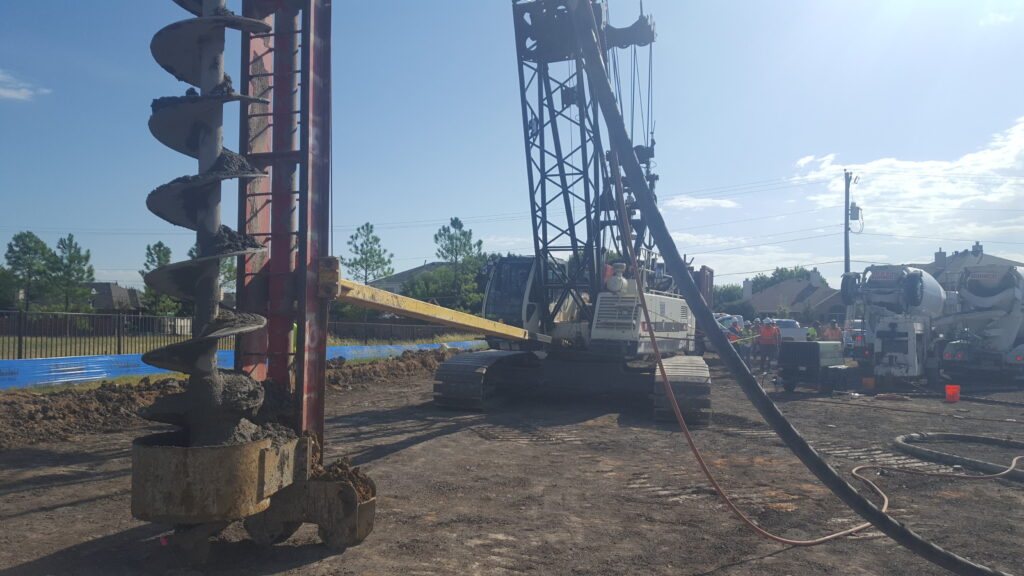
This screenshot has width=1024, height=576. Identify the location of chimney. (941, 253), (977, 246).